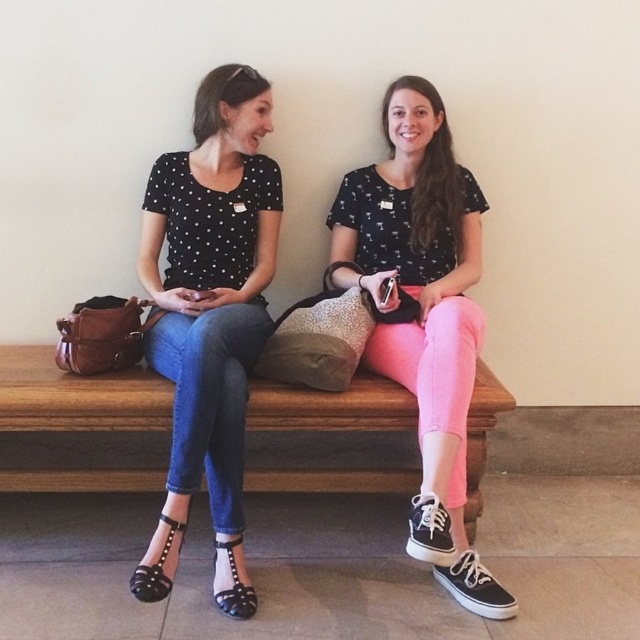
Question: Which object is farther from the camera taking this photo?

Choices:
 (A) wooden bench at center
 (B) matte black polka dot blouse at center
 (C) pink matte pants at center

Answer: (A)

Question: Is matte black polka dot blouse at center smaller than pink matte pants at center?

Choices:
 (A) no
 (B) yes

Answer: (B)

Question: Is matte black polka dot blouse at center smaller than pink matte pants at center?

Choices:
 (A) yes
 (B) no

Answer: (A)

Question: Is pink matte pants at center below wooden bench at center?

Choices:
 (A) yes
 (B) no

Answer: (B)

Question: Which object is the closest to the matte black polka dot blouse at center?

Choices:
 (A) pink matte pants at center
 (B) wooden bench at center

Answer: (B)

Question: Based on their relative distances, which object is nearer to the pink matte pants at center?

Choices:
 (A) wooden bench at center
 (B) matte black polka dot blouse at center

Answer: (B)